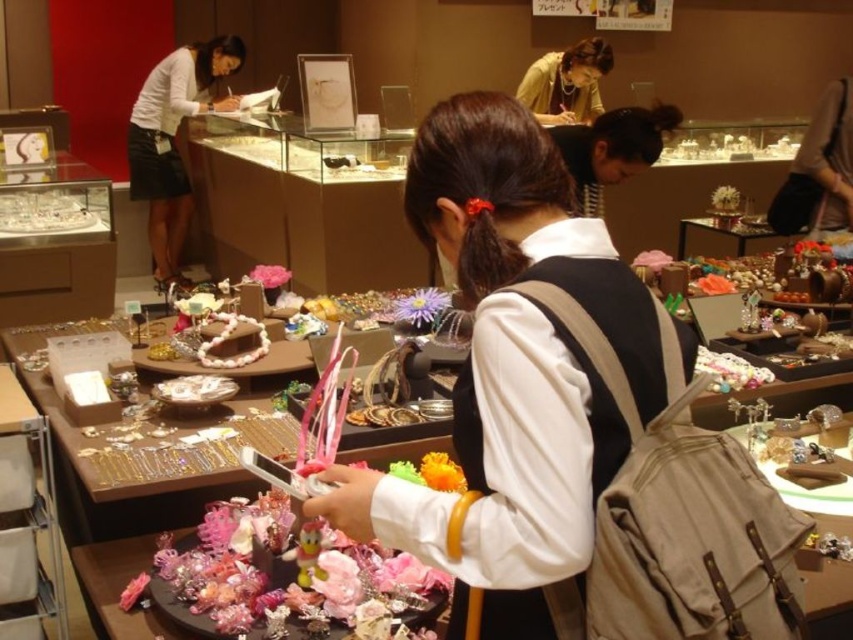
Based on the photo, is white matte skirt at upper left above matte yellow blouse at upper center?

Actually, white matte skirt at upper left is below matte yellow blouse at upper center.

Does white matte skirt at upper left have a lesser width compared to matte yellow blouse at upper center?

No.

You are a GUI agent. You are given a task and a screenshot of the screen. Output one action in this format:
    pyautogui.click(x=<x>, y=<y>)
    Task: Click on the white matte skirt at upper left
    The image size is (853, 640).
    Given the screenshot: What is the action you would take?
    pyautogui.click(x=173, y=140)

You are a GUI agent. You are given a task and a screenshot of the screen. Output one action in this format:
    pyautogui.click(x=<x>, y=<y>)
    Task: Click on the white matte skirt at upper left
    This screenshot has width=853, height=640.
    Given the screenshot: What is the action you would take?
    pyautogui.click(x=173, y=140)

Is white matte backpack at center bigger than white matte skirt at upper left?

Actually, white matte backpack at center might be smaller than white matte skirt at upper left.

Can you confirm if white matte backpack at center is thinner than white matte skirt at upper left?

Yes, white matte backpack at center is thinner than white matte skirt at upper left.

Measure the distance between point (582, 529) and camera.

Point (582, 529) is 82.15 centimeters away from camera.

Where is `white matte backpack at center`? The image size is (853, 640). white matte backpack at center is located at coordinates (512, 369).

Does white matte backpack at center have a smaller size compared to matte yellow blouse at upper center?

Indeed, white matte backpack at center has a smaller size compared to matte yellow blouse at upper center.

Does point (561, 492) come farther from viewer compared to point (548, 115)?

No, (561, 492) is in front of (548, 115).

Where is `white matte backpack at center`? This screenshot has width=853, height=640. white matte backpack at center is located at coordinates (512, 369).